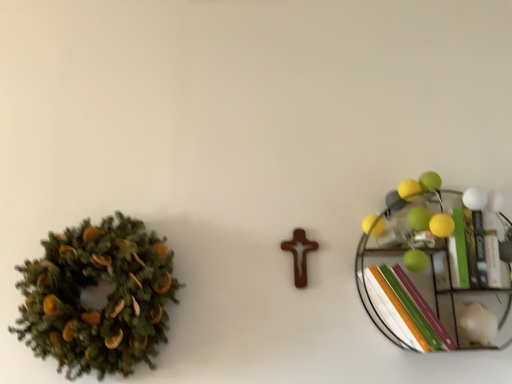
Question: Does green matte book at right have a larger size compared to metallic wire shelf at right?

Choices:
 (A) no
 (B) yes

Answer: (A)

Question: Is green matte book at right thinner than metallic wire shelf at right?

Choices:
 (A) yes
 (B) no

Answer: (B)

Question: From a real-world perspective, is green matte book at right on metallic wire shelf at right?

Choices:
 (A) yes
 (B) no

Answer: (A)

Question: Can you confirm if green matte book at right is smaller than metallic wire shelf at right?

Choices:
 (A) yes
 (B) no

Answer: (A)

Question: Could you tell me if green matte book at right is facing metallic wire shelf at right?

Choices:
 (A) no
 (B) yes

Answer: (B)

Question: From the image's perspective, is green matte book at right under metallic wire shelf at right?

Choices:
 (A) yes
 (B) no

Answer: (B)

Question: Considering the relative positions of green matte wreath at left and metallic wire shelf at right in the image provided, is green matte wreath at left behind metallic wire shelf at right?

Choices:
 (A) no
 (B) yes

Answer: (A)

Question: Does green matte wreath at left turn towards metallic wire shelf at right?

Choices:
 (A) no
 (B) yes

Answer: (A)

Question: From the image's perspective, is green matte wreath at left on top of metallic wire shelf at right?

Choices:
 (A) no
 (B) yes

Answer: (A)

Question: Does green matte wreath at left have a lesser height compared to metallic wire shelf at right?

Choices:
 (A) yes
 (B) no

Answer: (B)

Question: From a real-world perspective, is green matte wreath at left under metallic wire shelf at right?

Choices:
 (A) no
 (B) yes

Answer: (B)

Question: Does green matte wreath at left have a lesser width compared to metallic wire shelf at right?

Choices:
 (A) no
 (B) yes

Answer: (A)

Question: Are green matte book at right and green matte wreath at left far apart?

Choices:
 (A) yes
 (B) no

Answer: (B)